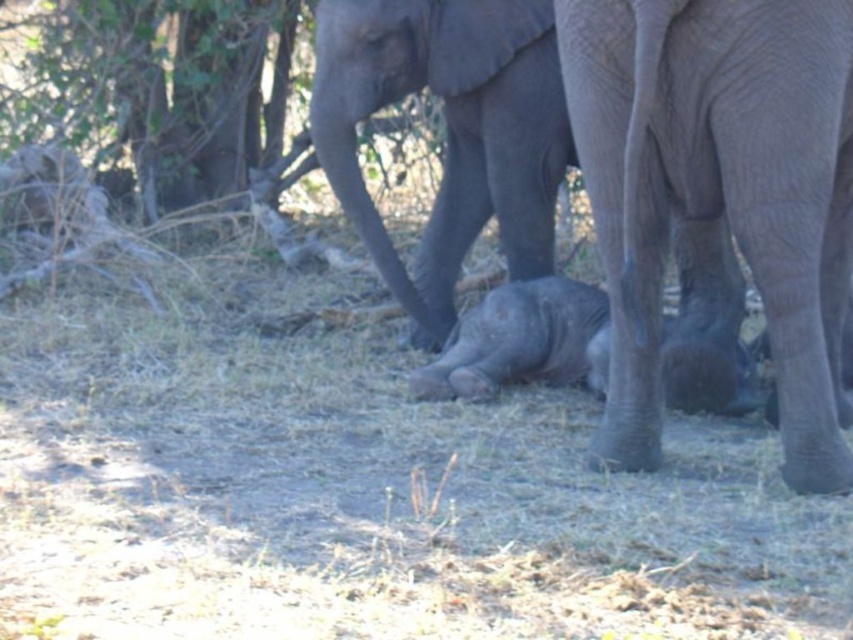
Which is behind, point (723, 588) or point (779, 284)?

The point (779, 284) is more distant.

The width and height of the screenshot is (853, 640). Identify the location of dry grass at center. (366, 490).

Where is `dry grass at center`? The height and width of the screenshot is (640, 853). dry grass at center is located at coordinates 366,490.

Which is in front, point (485, 177) or point (509, 337)?

Point (509, 337) is in front.

Is point (537, 40) behind point (463, 380)?

Yes, it is behind point (463, 380).

Does point (451, 278) lie behind point (515, 342)?

Yes, it is behind point (515, 342).

You are a GUI agent. You are given a task and a screenshot of the screen. Output one action in this format:
    pyautogui.click(x=<x>, y=<y>)
    Task: Click on the gray matte elephant at center
    This screenshot has width=853, height=640.
    Given the screenshot: What is the action you would take?
    pyautogui.click(x=448, y=131)

Is green leafy tree at upper left behind gray matte baby elephant at center?

Yes, green leafy tree at upper left is behind gray matte baby elephant at center.

This screenshot has width=853, height=640. What do you see at coordinates (155, 90) in the screenshot? I see `green leafy tree at upper left` at bounding box center [155, 90].

The image size is (853, 640). I want to click on green leafy tree at upper left, so click(x=155, y=90).